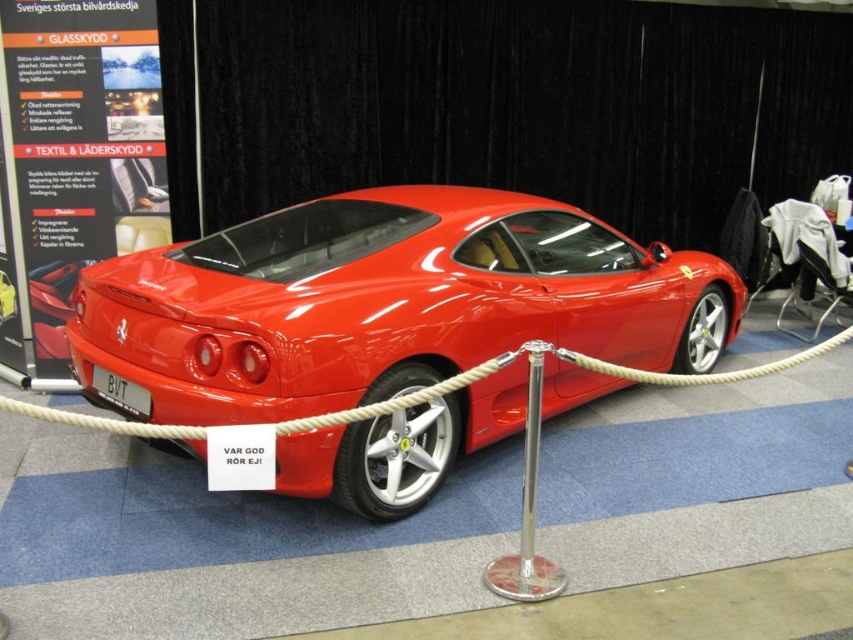
Does shiny red ferrari at center have a smaller size compared to white rope at center?

Incorrect, shiny red ferrari at center is not smaller in size than white rope at center.

Is shiny red ferrari at center positioned at the back of white rope at center?

Yes, it is behind white rope at center.

Which is behind, point (320, 460) or point (740, 380)?

Positioned behind is point (740, 380).

You are a GUI agent. You are given a task and a screenshot of the screen. Output one action in this format:
    pyautogui.click(x=<x>, y=<y>)
    Task: Click on the shiny red ferrari at center
    This screenshot has height=640, width=853.
    Given the screenshot: What is the action you would take?
    pyautogui.click(x=381, y=305)

Looking at this image, measure the distance from white rope at center to glossy red car at center.

white rope at center and glossy red car at center are 3.01 meters apart.

Does white rope at center have a lesser height compared to glossy red car at center?

Yes, white rope at center is shorter than glossy red car at center.

Find the location of a particular element. The height and width of the screenshot is (640, 853). white rope at center is located at coordinates (x=698, y=374).

Can you confirm if white rope at center is positioned to the right of polished silver pole at center?

In fact, white rope at center is to the left of polished silver pole at center.

How much distance is there between white rope at center and polished silver pole at center?

white rope at center and polished silver pole at center are 19.64 inches apart.

Locate an element on the screen. Image resolution: width=853 pixels, height=640 pixels. white rope at center is located at coordinates (698, 374).